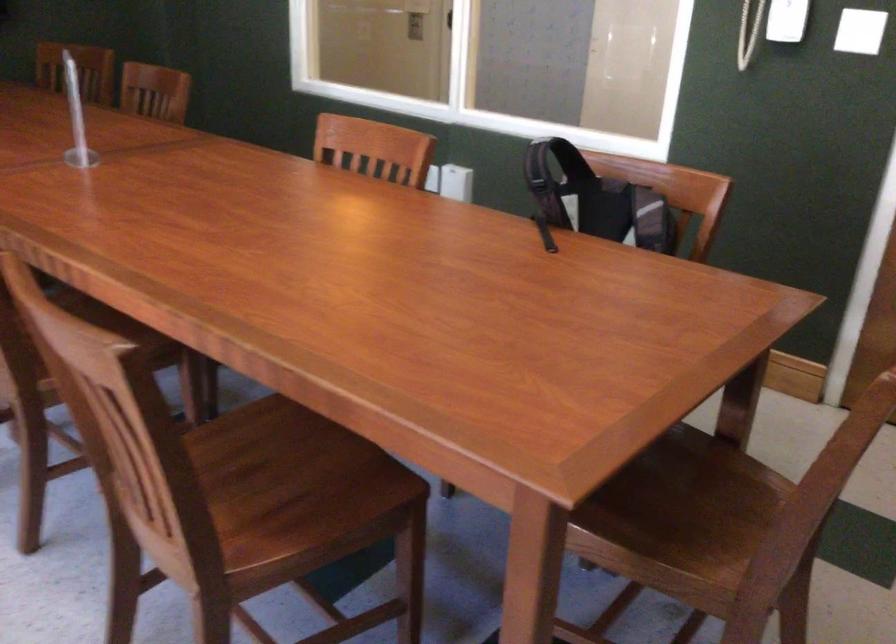
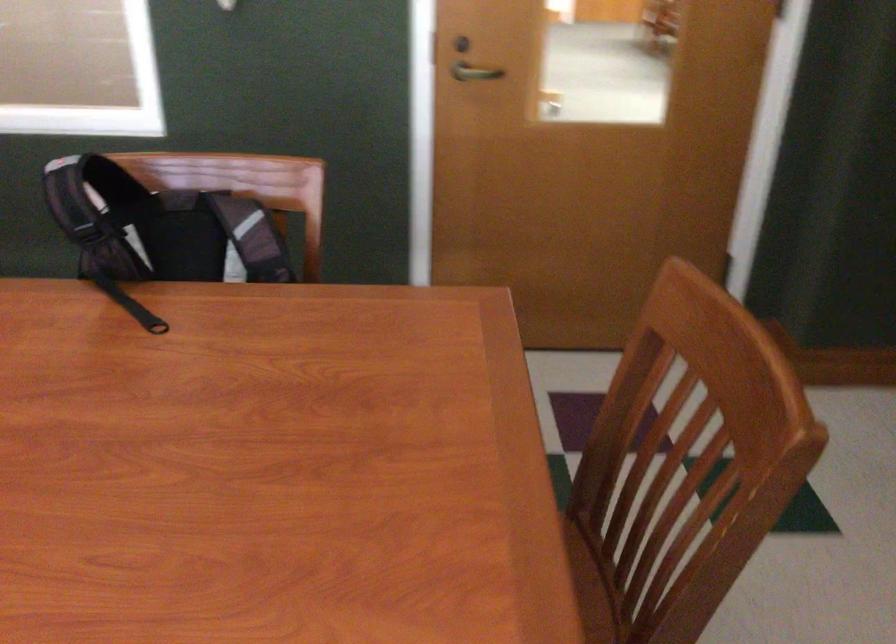
Where in the second image is the point corresponding to pixel 591 196 from the first image?

(159, 228)